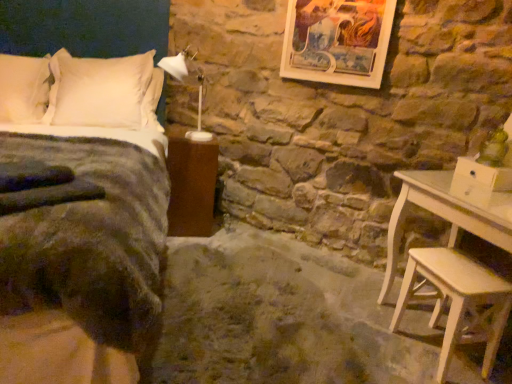
Measure the distance between point (46, 240) and camera.

The depth of point (46, 240) is 4.18 feet.

In order to face wooden framed artwork at upper center, should I rotate leftwards or rightwards?

You should look right and rotate roughly 10.285 degrees.

You are a GUI agent. You are given a task and a screenshot of the screen. Output one action in this format:
    pyautogui.click(x=<x>, y=<y>)
    Task: Click on the wooden framed artwork at upper center
    Image resolution: width=512 pixels, height=384 pixels.
    Given the screenshot: What is the action you would take?
    pyautogui.click(x=337, y=41)

In order to face white soft pillow at upper left, the second pillow when ordered from right to left, should I rotate leftwards or rightwards?

Turn left by 28.757 degrees to look at white soft pillow at upper left, the second pillow when ordered from right to left.

Image resolution: width=512 pixels, height=384 pixels. What do you see at coordinates (24, 88) in the screenshot?
I see `white soft pillow at upper left, the 1th pillow from the left` at bounding box center [24, 88].

This screenshot has height=384, width=512. Describe the element at coordinates (182, 81) in the screenshot. I see `white plastic lamp at upper center` at that location.

Find the location of `velvet dark green bed at left`. velvet dark green bed at left is located at coordinates (x=85, y=223).

From the image's perspective, relative to white soft pillow at upper left, the second pillow when ordered from right to left, is white plastic lamp at upper center above or below?

white plastic lamp at upper center is below white soft pillow at upper left, the second pillow when ordered from right to left.

Does white plastic lamp at upper center contain white soft pillow at upper left, the second pillow when ordered from right to left?

Actually, white soft pillow at upper left, the second pillow when ordered from right to left, is outside white plastic lamp at upper center.

Is white plastic lamp at upper center next to white soft pillow at upper left, the 1th pillow from the left?

white plastic lamp at upper center is not next to white soft pillow at upper left, the 1th pillow from the left, and they're not touching.

There is a white plastic lamp at upper center. At what (x,y) coordinates should I click in order to perform the action: click on the 2nd pillow above it (from the image's perspective). Please return your answer as a coordinate pair (x, y). Looking at the image, I should click on (24, 88).

Looking at this image, is white soft pillow at upper left, the 1th pillow when ordered from right to left, directly adjacent to brown wood nightstand at lower left?

white soft pillow at upper left, the 1th pillow when ordered from right to left, and brown wood nightstand at lower left are not in contact.

Is white soft pillow at upper left, the 1th pillow when ordered from right to left, aimed at brown wood nightstand at lower left?

No, white soft pillow at upper left, the 1th pillow when ordered from right to left, is not aimed at brown wood nightstand at lower left.

Between white soft pillow at upper left, the 1th pillow when ordered from right to left, and brown wood nightstand at lower left, which one appears on the left side from the viewer's perspective?

Positioned to the left is white soft pillow at upper left, the 1th pillow when ordered from right to left.

Can you confirm if white soft pillow at upper left, the 1th pillow when ordered from right to left, is smaller than brown wood nightstand at lower left?

Actually, white soft pillow at upper left, the 1th pillow when ordered from right to left, might be larger than brown wood nightstand at lower left.

From a real-world perspective, is wooden framed artwork at upper center physically below brown wood nightstand at lower left?

No, from a real-world perspective, wooden framed artwork at upper center is not below brown wood nightstand at lower left.

Could you tell me if wooden framed artwork at upper center is facing brown wood nightstand at lower left?

No, wooden framed artwork at upper center is not facing towards brown wood nightstand at lower left.

From the image's perspective, which object appears higher, wooden framed artwork at upper center or brown wood nightstand at lower left?

wooden framed artwork at upper center is shown above in the image.

Is wooden framed artwork at upper center in front of brown wood nightstand at lower left?

Yes, wooden framed artwork at upper center is closer to the viewer.

From a real-world perspective, relative to white plastic lamp at upper center, is wooden framed artwork at upper center vertically above or below?

wooden framed artwork at upper center is above white plastic lamp at upper center.

Is wooden framed artwork at upper center in contact with white plastic lamp at upper center?

No, wooden framed artwork at upper center is not making contact with white plastic lamp at upper center.

Is wooden framed artwork at upper center smaller than white plastic lamp at upper center?

Yes.

Can you confirm if light wood stool at lower right is taller than white plastic lamp at upper center?

No, light wood stool at lower right is not taller than white plastic lamp at upper center.

Does light wood stool at lower right have a greater width compared to white plastic lamp at upper center?

No.

Locate an element on the screen. stool in front of the white plastic lamp at upper center is located at coordinates click(x=458, y=302).

Is light wood stool at lower right spatially inside white plastic lamp at upper center, or outside of it?

The correct answer is: outside.

Considering the positions of objects light wood stool at lower right and brown wood nightstand at lower left in the image provided, who is more to the right, light wood stool at lower right or brown wood nightstand at lower left?

light wood stool at lower right.

From the picture: From a real-world perspective, is light wood stool at lower right over brown wood nightstand at lower left?

No, from a real-world perspective, light wood stool at lower right is not above brown wood nightstand at lower left.

Which of these two, light wood stool at lower right or brown wood nightstand at lower left, stands taller?

With more height is brown wood nightstand at lower left.

Which point is more distant from viewer, (406, 298) or (173, 194)?

The point (173, 194) is more distant.

Which of these two, light wood stool at lower right or wooden framed artwork at upper center, is wider?

light wood stool at lower right.

Between light wood stool at lower right and wooden framed artwork at upper center, which one has more height?

With more height is wooden framed artwork at upper center.

From a real-world perspective, is light wood stool at lower right positioned under wooden framed artwork at upper center based on gravity?

Indeed, from a real-world perspective, light wood stool at lower right is positioned beneath wooden framed artwork at upper center.

Identify the location of stool below the wooden framed artwork at upper center (from the image's perspective). (458, 302).

Locate an element on the screen. The image size is (512, 384). the 2nd pillow located beneath the white plastic lamp at upper center (from a real-world perspective) is located at coordinates [x=24, y=88].

Locate an element on the screen. The width and height of the screenshot is (512, 384). the 1st pillow above the brown wood nightstand at lower left (from the image's perspective) is located at coordinates (104, 91).

From the image, which object appears to be farther from velvet dark green bed at left, wooden framed artwork at upper center or white plastic lamp at upper center?

The object further to velvet dark green bed at left is wooden framed artwork at upper center.

Based on their spatial positions, is wooden framed artwork at upper center or white soft pillow at upper left, the 1th pillow from the left, closer to velvet dark green bed at left?

Based on the image, white soft pillow at upper left, the 1th pillow from the left, appears to be nearer to velvet dark green bed at left.

Which object lies further to the anchor point white soft pillow at upper left, the 1th pillow from the left, velvet dark green bed at left or white plastic lamp at upper center?

white plastic lamp at upper center is positioned further to the anchor white soft pillow at upper left, the 1th pillow from the left.

Based on their spatial positions, is wooden framed artwork at upper center or white plastic lamp at upper center further from brown wood nightstand at lower left?

Based on the image, wooden framed artwork at upper center appears to be further to brown wood nightstand at lower left.

Estimate the real-world distances between objects in this image. Which object is closer to wooden framed artwork at upper center, velvet dark green bed at left or light wood stool at lower right?

Among the two, light wood stool at lower right is located nearer to wooden framed artwork at upper center.

Based on their spatial positions, is light wood stool at lower right or white plastic lamp at upper center closer to wooden framed artwork at upper center?

Based on the image, white plastic lamp at upper center appears to be nearer to wooden framed artwork at upper center.

Looking at the image, which one is located closer to white soft pillow at upper left, the 1th pillow from the left, light wood stool at lower right or wooden framed artwork at upper center?

wooden framed artwork at upper center is closer to white soft pillow at upper left, the 1th pillow from the left.

Consider the image. From the image, which object appears to be farther from white soft pillow at upper left, the 1th pillow when ordered from right to left, velvet dark green bed at left or white plastic lamp at upper center?

The object further to white soft pillow at upper left, the 1th pillow when ordered from right to left, is velvet dark green bed at left.

This screenshot has width=512, height=384. Identify the location of pillow between white soft pillow at upper left, the 1th pillow from the left, and wooden framed artwork at upper center from left to right. (104, 91).

At what (x,y) coordinates should I click in order to perform the action: click on lamp situated between brown wood nightstand at lower left and wooden framed artwork at upper center from left to right. Please return your answer as a coordinate pair (x, y). This screenshot has height=384, width=512. Looking at the image, I should click on (182, 81).

You are a GUI agent. You are given a task and a screenshot of the screen. Output one action in this format:
    pyautogui.click(x=<x>, y=<y>)
    Task: Click on the pillow located between velvet dark green bed at left and white soft pillow at upper left, the 1th pillow when ordered from right to left, in the depth direction
    
    Given the screenshot: What is the action you would take?
    pyautogui.click(x=24, y=88)

Find the location of a particular element. This screenshot has height=384, width=512. lamp that lies between wooden framed artwork at upper center and light wood stool at lower right from top to bottom is located at coordinates (182, 81).